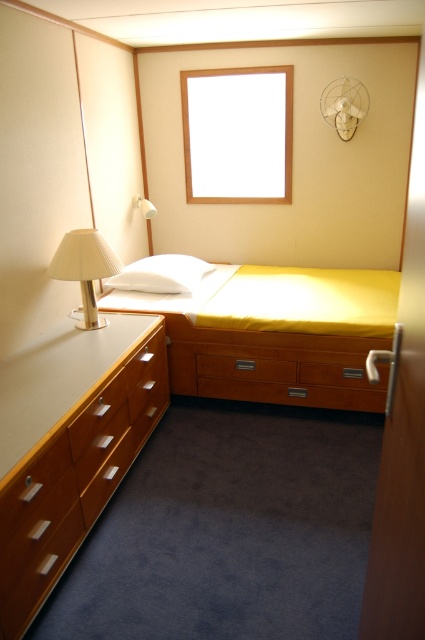
Question: Can you confirm if matte gold lamp at left is positioned to the right of white soft pillow at center?

Choices:
 (A) yes
 (B) no

Answer: (B)

Question: Does matte wood drawer at lower left lie behind matte gold lamp at left?

Choices:
 (A) yes
 (B) no

Answer: (B)

Question: Considering the real-world distances, which object is farthest from the wooden dresser at left?

Choices:
 (A) yellow fabric bed at center
 (B) matte wood drawer at lower left

Answer: (A)

Question: Which of the following is the farthest from the observer?

Choices:
 (A) (5, 586)
 (B) (31, 483)
 (C) (116, 308)

Answer: (C)

Question: Can you confirm if yellow fabric bed at center is bigger than white matte lampshade at upper left?

Choices:
 (A) yes
 (B) no

Answer: (A)

Question: Which point appears farthest from the camera in this image?

Choices:
 (A) (87, 496)
 (B) (141, 198)

Answer: (B)